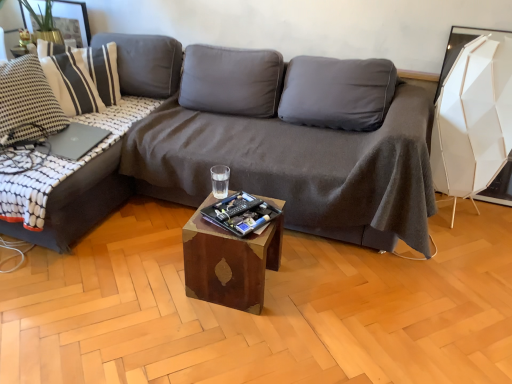
Locate an element on the screen. vacant area that lies to the right of wooden cube at center is located at coordinates (304, 288).